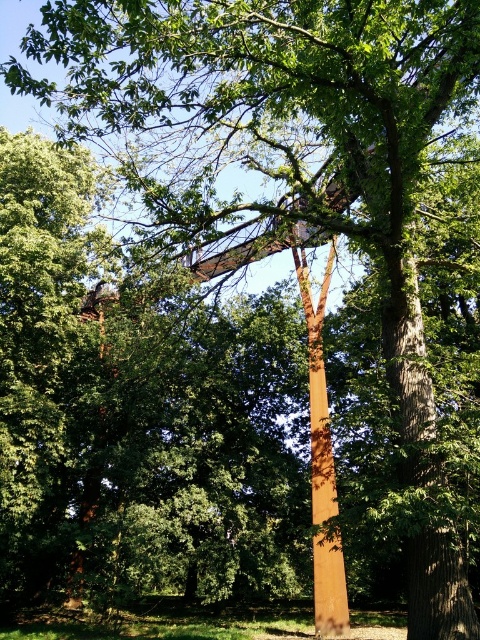
In the scene shown: You are standing in the forest scene looking at the two points marked. Which point, point (387,323) or point (331,268), is closer to you?

Point (387,323) is closer to you than point (331,268).

You are a hiker trying to determine which object is smaller between the smooth brown tree trunk at center and the golden polished pole at center. Based on the scene, which one is smaller?

The smooth brown tree trunk at center is smaller compared to the golden polished pole at center.